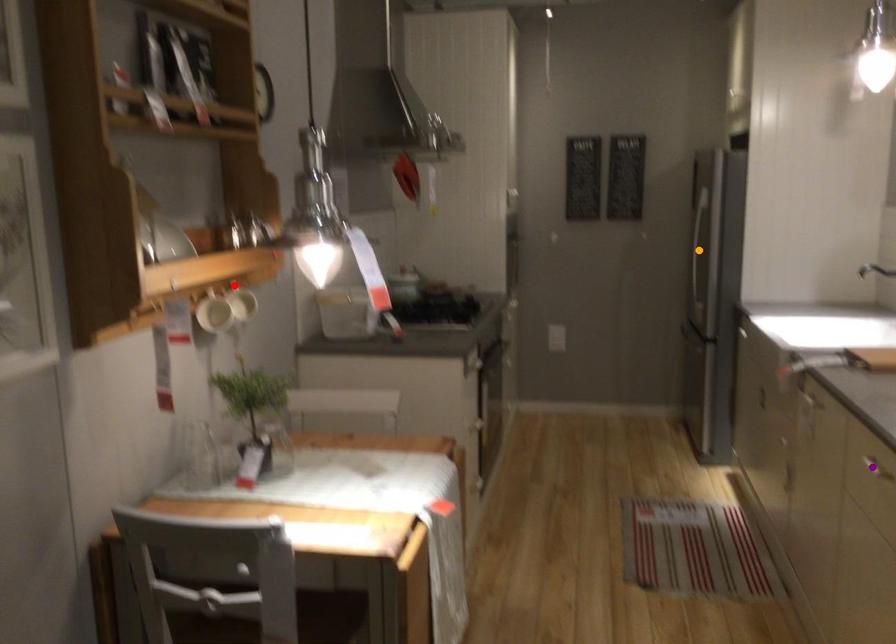
Order these from nearest to farthest:
A) orange point
B) red point
C) purple point

1. purple point
2. red point
3. orange point